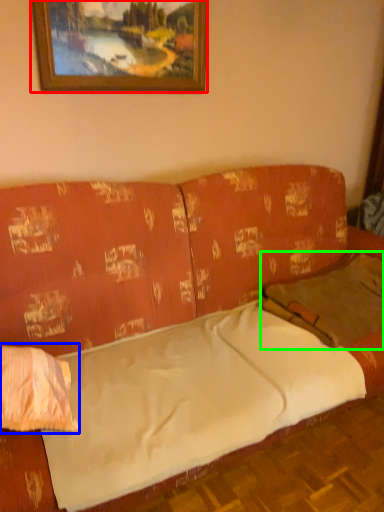
Question: Which object is the farthest from picture frame (highlighted by a red box)? Choose among these: pillow (highlighted by a blue box) or pillow (highlighted by a green box).

Choices:
 (A) pillow
 (B) pillow

Answer: (A)